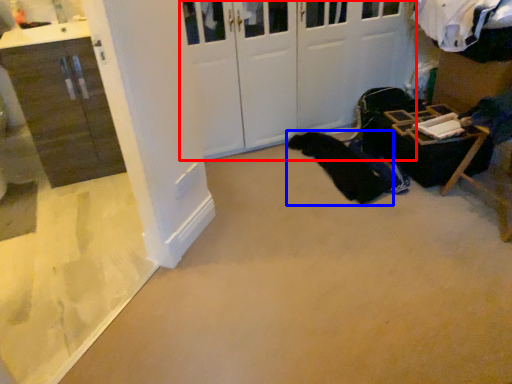
Question: Which point is further to the camera, door (highlighted by a red box) or clothing (highlighted by a blue box)?

Choices:
 (A) door
 (B) clothing

Answer: (B)